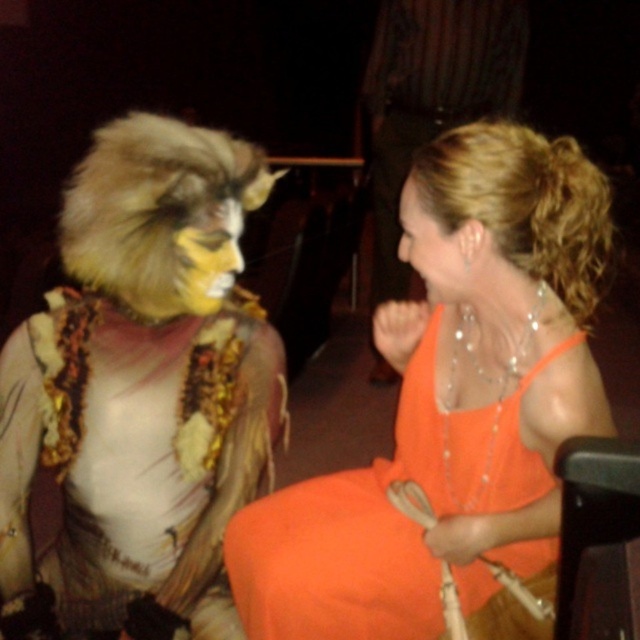
Question: From the image, what is the correct spatial relationship of furry costume at left in relation to fluffy fur costume at center?

Choices:
 (A) below
 (B) above

Answer: (A)

Question: Is yellow fur face at center behind smooth orange dress at center?

Choices:
 (A) yes
 (B) no

Answer: (B)

Question: Does furry costume at left have a lesser width compared to orange satin dress at center?

Choices:
 (A) no
 (B) yes

Answer: (B)

Question: Which object is positioned farthest from the furry costume at left?

Choices:
 (A) yellow fur face at center
 (B) smooth orange dress at center

Answer: (B)

Question: Which is nearer to the fluffy fur costume at center?

Choices:
 (A) smooth orange dress at center
 (B) yellow fur face at center
 (C) orange satin dress at center
 (D) furry costume at left

Answer: (C)

Question: Which object appears farthest from the camera in this image?

Choices:
 (A) smooth orange dress at center
 (B) furry costume at left

Answer: (A)